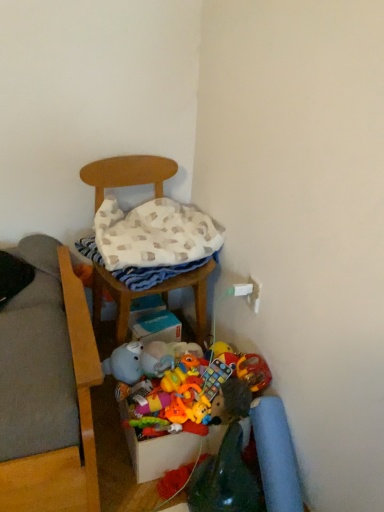
Question: Considering the relative positions of multicolored fabric storage box at lower center and wooden chair at center in the image provided, is multicolored fabric storage box at lower center to the left of wooden chair at center from the viewer's perspective?

Choices:
 (A) yes
 (B) no

Answer: (B)

Question: Can you confirm if multicolored fabric storage box at lower center is bigger than wooden chair at center?

Choices:
 (A) yes
 (B) no

Answer: (B)

Question: Is multicolored fabric storage box at lower center thinner than wooden chair at center?

Choices:
 (A) no
 (B) yes

Answer: (B)

Question: Does multicolored fabric storage box at lower center have a smaller size compared to wooden chair at center?

Choices:
 (A) yes
 (B) no

Answer: (A)

Question: From the image's perspective, is multicolored fabric storage box at lower center located beneath wooden chair at center?

Choices:
 (A) no
 (B) yes

Answer: (B)

Question: Considering the relative sizes of multicolored fabric storage box at lower center and wooden chair at center in the image provided, is multicolored fabric storage box at lower center taller than wooden chair at center?

Choices:
 (A) yes
 (B) no

Answer: (B)

Question: Considering the relative positions of soft plush toy at center and multicolored fabric storage box at lower center in the image provided, is soft plush toy at center to the right of multicolored fabric storage box at lower center from the viewer's perspective?

Choices:
 (A) no
 (B) yes

Answer: (A)

Question: Considering the relative positions of soft plush toy at center and multicolored fabric storage box at lower center in the image provided, is soft plush toy at center to the left of multicolored fabric storage box at lower center from the viewer's perspective?

Choices:
 (A) yes
 (B) no

Answer: (A)

Question: From a real-world perspective, does soft plush toy at center sit lower than multicolored fabric storage box at lower center?

Choices:
 (A) no
 (B) yes

Answer: (A)

Question: Does soft plush toy at center have a lesser height compared to multicolored fabric storage box at lower center?

Choices:
 (A) no
 (B) yes

Answer: (B)

Question: Is soft plush toy at center oriented away from multicolored fabric storage box at lower center?

Choices:
 (A) yes
 (B) no

Answer: (B)

Question: Is soft plush toy at center positioned beyond the bounds of multicolored fabric storage box at lower center?

Choices:
 (A) no
 (B) yes

Answer: (B)

Question: Considering the relative sizes of wooden chair at center and multicolored fabric storage box at lower center in the image provided, is wooden chair at center taller than multicolored fabric storage box at lower center?

Choices:
 (A) yes
 (B) no

Answer: (A)